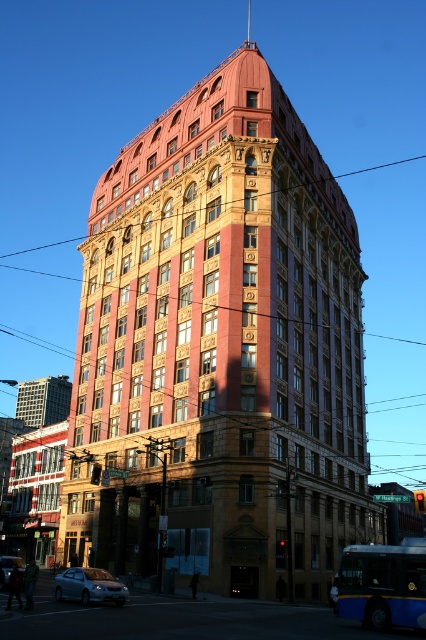
You are a pedestrian standing in front of the corner building and want to cross the street. You see the blue metallic bus at lower right and the silver metallic sedan at lower left. Which vehicle is nearer to you?

The blue metallic bus at lower right is closer to the viewer than the silver metallic sedan at lower left, so the blue metallic bus at lower right is nearer to you.

You are a delivery driver who needs to park your truck between the two sedans in the image. The truck requires a minimum of 4 meters of space. Can you fit your truck between the satin silver sedan at lower left and the silver metallic sedan at lower left?

The satin silver sedan at lower left is 3.97 meters away from the silver metallic sedan at lower left. Since the required space is 4 meters, the truck cannot fit between them as the available space is slightly less than needed.

You are driving a car and want to park in the parking lot near the corner building. You see a satin silver sedan at lower left and a silver metallic sedan at lower left. Which car is closer to you?

The satin silver sedan at lower left is closer to you because it is in front of the silver metallic sedan at lower left.